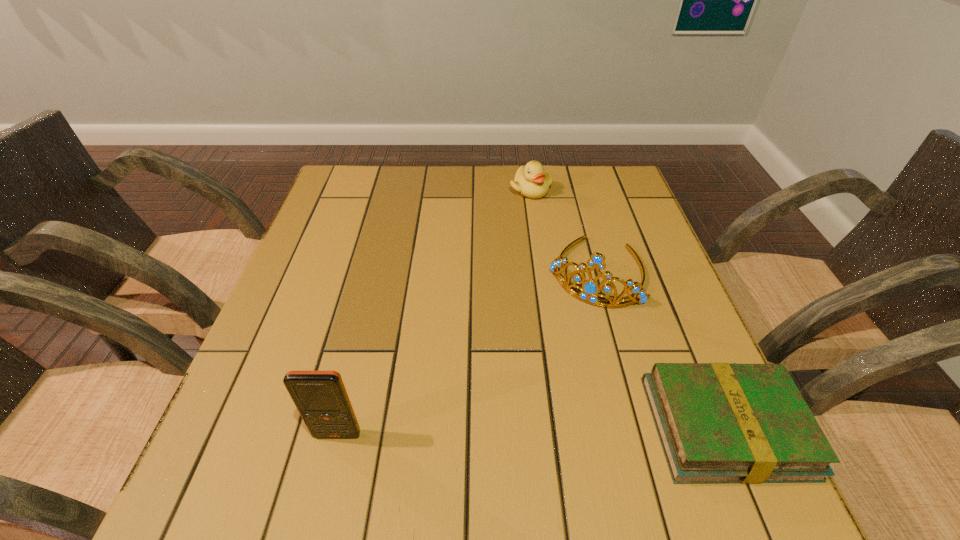
I want to click on object located in the near left corner section of the desktop, so click(321, 398).

Where is `object at the near right corner`? The width and height of the screenshot is (960, 540). object at the near right corner is located at coordinates 717,422.

The height and width of the screenshot is (540, 960). Find the location of `vacant space at the far edge of the desktop`. vacant space at the far edge of the desktop is located at coordinates (447, 184).

I want to click on vacant area at the near edge, so click(x=576, y=401).

I want to click on vacant space at the left edge of the desktop, so click(316, 288).

At what (x,y) coordinates should I click in order to perform the action: click on vacant space at the right edge of the desktop. Please return your answer as a coordinate pair (x, y). The height and width of the screenshot is (540, 960). Looking at the image, I should click on (650, 358).

This screenshot has width=960, height=540. In order to click on vacant space at the far right corner in this screenshot , I will do `click(612, 167)`.

You are a GUI agent. You are given a task and a screenshot of the screen. Output one action in this format:
    pyautogui.click(x=<x>, y=<y>)
    Task: Click on the free area in between the cellular telephone and the tiara
    
    Given the screenshot: What is the action you would take?
    pyautogui.click(x=467, y=353)

Locate an element on the screen. The image size is (960, 540). vacant area that lies between the tiara and the second shortest object is located at coordinates (564, 231).

The width and height of the screenshot is (960, 540). In order to click on free space between the duckling and the book in this screenshot , I will do `click(628, 308)`.